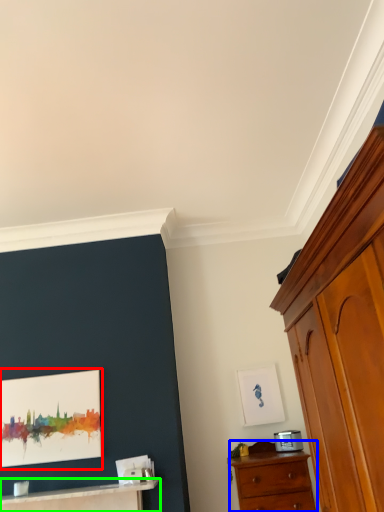
Question: Which object is positioned farthest from picture frame (highlighted by a red box)? Select from chest of drawers (highlighted by a blue box) and table (highlighted by a green box).

Choices:
 (A) chest of drawers
 (B) table

Answer: (A)